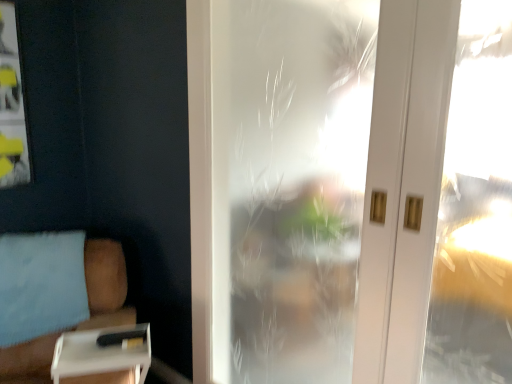
Question: Does white plastic tray at lower left have a greater height compared to white matte box at lower left?

Choices:
 (A) no
 (B) yes

Answer: (A)

Question: Considering the relative sizes of white plastic tray at lower left and white matte box at lower left in the image provided, is white plastic tray at lower left thinner than white matte box at lower left?

Choices:
 (A) no
 (B) yes

Answer: (B)

Question: From a real-world perspective, does white plastic tray at lower left stand above white matte box at lower left?

Choices:
 (A) no
 (B) yes

Answer: (B)

Question: From the image's perspective, does white plastic tray at lower left appear lower than white matte box at lower left?

Choices:
 (A) no
 (B) yes

Answer: (A)

Question: Is white plastic tray at lower left shorter than white matte box at lower left?

Choices:
 (A) no
 (B) yes

Answer: (B)

Question: From the image's perspective, is white plastic tray at lower left positioned above or below white matte box at lower left?

Choices:
 (A) above
 (B) below

Answer: (A)

Question: Based on their sizes in the image, would you say white plastic tray at lower left is bigger or smaller than white matte box at lower left?

Choices:
 (A) big
 (B) small

Answer: (B)

Question: Relative to white matte box at lower left, is white plastic tray at lower left in front or behind?

Choices:
 (A) front
 (B) behind

Answer: (B)

Question: Considering the relative positions of white plastic tray at lower left and white matte box at lower left in the image provided, is white plastic tray at lower left to the left or to the right of white matte box at lower left?

Choices:
 (A) right
 (B) left

Answer: (A)

Question: Does point (435, 173) appear closer or farther from the camera than point (108, 345)?

Choices:
 (A) farther
 (B) closer

Answer: (B)

Question: In terms of width, does frosted glass door at center look wider or thinner when compared to white plastic tray at lower left?

Choices:
 (A) thin
 (B) wide

Answer: (A)

Question: From the image's perspective, relative to white plastic tray at lower left, is frosted glass door at center above or below?

Choices:
 (A) below
 (B) above

Answer: (B)

Question: From their relative heights in the image, would you say frosted glass door at center is taller or shorter than white plastic tray at lower left?

Choices:
 (A) tall
 (B) short

Answer: (A)

Question: Is white plastic tray at lower left wider or thinner than frosted glass door at center?

Choices:
 (A) thin
 (B) wide

Answer: (B)

Question: From the image's perspective, is white plastic tray at lower left positioned above or below frosted glass door at center?

Choices:
 (A) below
 (B) above

Answer: (A)